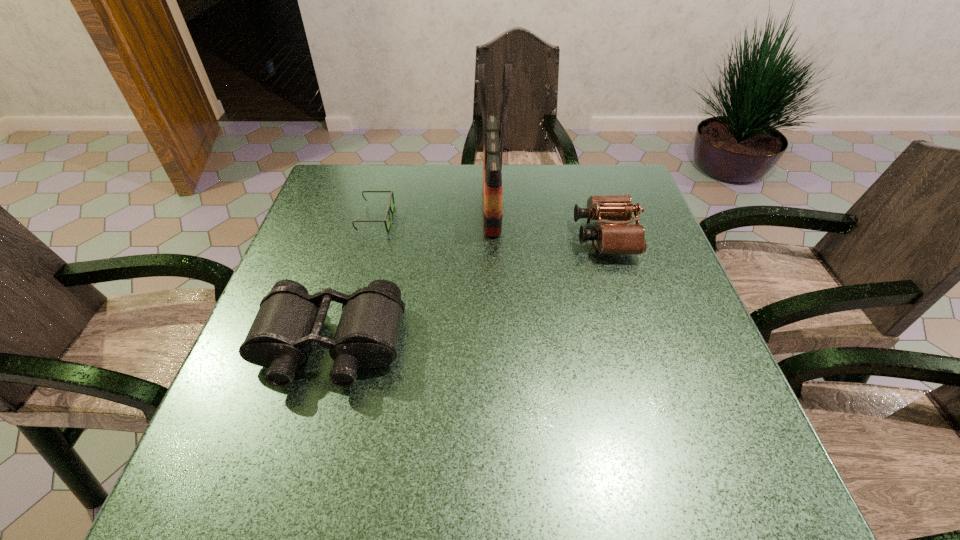
What are the coordinates of `free space between the nearest object and the right binoculars` in the screenshot? It's located at (468, 291).

Identify the location of vacant space in between the tallest object and the spectacles. (434, 212).

Where is `free spot between the tallest object and the farther binoculars`? The height and width of the screenshot is (540, 960). free spot between the tallest object and the farther binoculars is located at coordinates (548, 221).

Where is `vacant point located between the nearer binoculars and the right binoculars`? vacant point located between the nearer binoculars and the right binoculars is located at coordinates (468, 291).

Image resolution: width=960 pixels, height=540 pixels. Identify the location of empty space that is in between the rightmost object and the second object from right to left. (548, 221).

The width and height of the screenshot is (960, 540). In order to click on free space between the nearer binoculars and the third object from left to right in this screenshot , I will do `click(411, 276)`.

Locate an element on the screen. The height and width of the screenshot is (540, 960). free space between the spectacles and the left binoculars is located at coordinates (353, 282).

Where is `unoccupied area between the tallest object and the farther binoculars`? The width and height of the screenshot is (960, 540). unoccupied area between the tallest object and the farther binoculars is located at coordinates (548, 221).

Identify which object is the nearest to the spectacles. Please provide its 2D coordinates. Your answer should be formatted as a tuple, i.e. [(x, y)], where the tuple contains the x and y coordinates of a point satisfying the conditions above.

[(492, 161)]

Select which object appears as the third closest to the shopping bag. Please provide its 2D coordinates. Your answer should be formatted as a tuple, i.e. [(x, y)], where the tuple contains the x and y coordinates of a point satisfying the conditions above.

[(289, 320)]